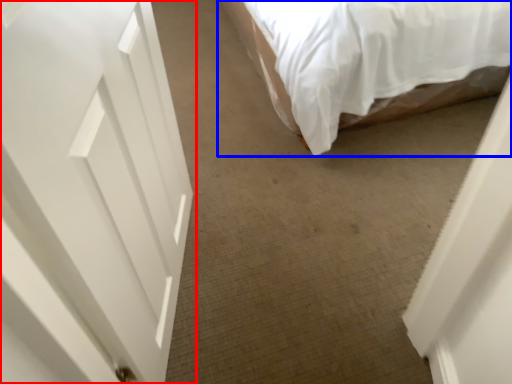
Question: Which of the following is the farthest to the observer, door (highlighted by a red box) or bed (highlighted by a blue box)?

Choices:
 (A) door
 (B) bed

Answer: (B)